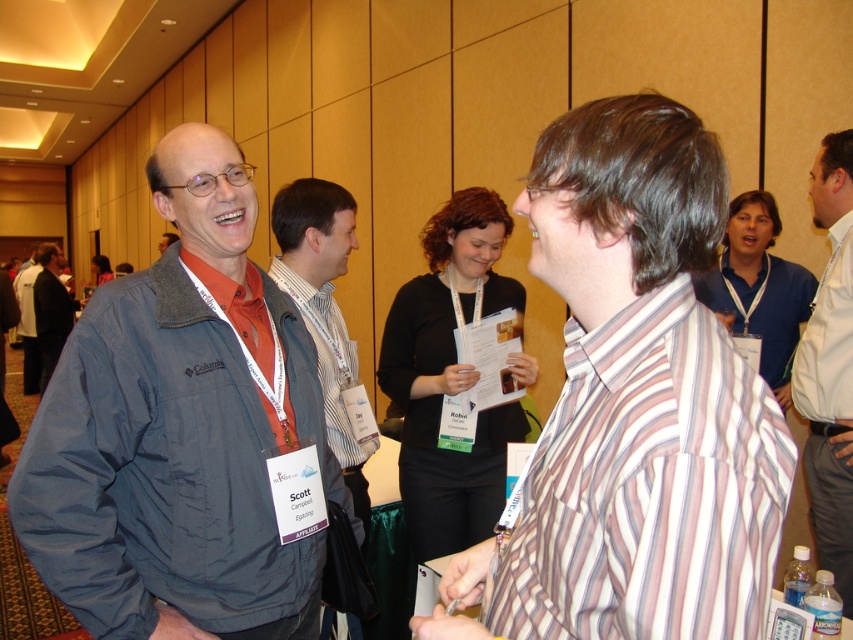
Is dark blue jacket at left positioned in front of white shirt at right?

Yes, dark blue jacket at left is closer to the viewer.

Does dark blue jacket at left appear on the right side of white shirt at right?

No, dark blue jacket at left is not to the right of white shirt at right.

Does point (265, 564) come closer to viewer compared to point (834, 280)?

Yes, it is in front of point (834, 280).

At what (x,y) coordinates should I click in order to perform the action: click on dark blue jacket at left. Please return your answer as a coordinate pair (x, y). This screenshot has width=853, height=640. Looking at the image, I should click on (178, 432).

In the scene shown: Which of these two, striped cotton shirt at center or dark blue jacket at left, stands taller?

dark blue jacket at left is taller.

Is point (584, 148) in front of point (219, 150)?

Yes, it is in front of point (219, 150).

Locate an element on the screen. The width and height of the screenshot is (853, 640). striped cotton shirt at center is located at coordinates (633, 404).

Is point (318, 188) farther from viewer compared to point (48, 264)?

No.

Can you confirm if gray fabric vest at center is bigger than dark gray jacket at left?

No, gray fabric vest at center is not bigger than dark gray jacket at left.

Which is in front, point (331, 336) or point (50, 326)?

Point (331, 336) is in front.

Locate an element on the screen. The width and height of the screenshot is (853, 640). gray fabric vest at center is located at coordinates (326, 316).